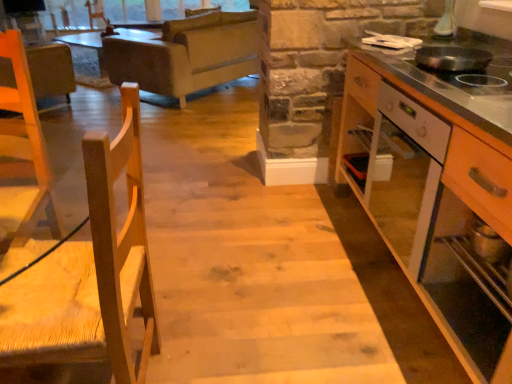
Question: Can you confirm if light gray fabric couch at upper center is taller than wooden cabinet at right?

Choices:
 (A) no
 (B) yes

Answer: (A)

Question: From the image's perspective, is light gray fabric couch at upper center below wooden cabinet at right?

Choices:
 (A) no
 (B) yes

Answer: (A)

Question: Considering the relative sizes of light gray fabric couch at upper center and wooden cabinet at right in the image provided, is light gray fabric couch at upper center smaller than wooden cabinet at right?

Choices:
 (A) yes
 (B) no

Answer: (B)

Question: Can you confirm if light gray fabric couch at upper center is bigger than wooden cabinet at right?

Choices:
 (A) yes
 (B) no

Answer: (A)

Question: Would you consider light gray fabric couch at upper center to be distant from wooden cabinet at right?

Choices:
 (A) no
 (B) yes

Answer: (B)

Question: Is light gray fabric couch at upper center aimed at wooden cabinet at right?

Choices:
 (A) no
 (B) yes

Answer: (A)

Question: Is natural wood chair at left outside light gray fabric couch at upper center?

Choices:
 (A) yes
 (B) no

Answer: (A)

Question: Can you confirm if natural wood chair at left is wider than light gray fabric couch at upper center?

Choices:
 (A) no
 (B) yes

Answer: (A)

Question: Can you confirm if natural wood chair at left is bigger than light gray fabric couch at upper center?

Choices:
 (A) no
 (B) yes

Answer: (A)

Question: Is natural wood chair at left closer to camera compared to light gray fabric couch at upper center?

Choices:
 (A) no
 (B) yes

Answer: (B)

Question: Does natural wood chair at left appear on the right side of light gray fabric couch at upper center?

Choices:
 (A) yes
 (B) no

Answer: (A)

Question: Can you confirm if natural wood chair at left is thinner than light gray fabric couch at upper center?

Choices:
 (A) yes
 (B) no

Answer: (A)

Question: Is natural wood chair at left not within wooden cabinet at right?

Choices:
 (A) no
 (B) yes

Answer: (B)